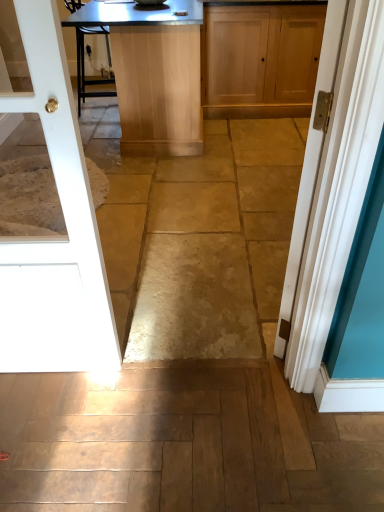
Question: From a real-world perspective, is white painted wood door at right, marked as the first door in a right-to-left arrangement, above or below light brown wooden table at center?

Choices:
 (A) below
 (B) above

Answer: (B)

Question: Is white painted wood door at right, marked as the first door in a right-to-left arrangement, inside the boundaries of light brown wooden table at center, or outside?

Choices:
 (A) inside
 (B) outside

Answer: (B)

Question: Which is farther from the light brown wooden table at center?

Choices:
 (A) matte wood cabinet at upper center
 (B) white painted wood door at right, marked as the first door in a right-to-left arrangement
 (C) white glossy door at left, arranged as the first door when viewed from the left

Answer: (C)

Question: Which of these objects is positioned farthest from the white glossy door at left, acting as the second door starting from the right?

Choices:
 (A) light brown wooden table at center
 (B) white painted wood door at right, positioned as the 2th door in left-to-right order
 (C) matte wood cabinet at upper center

Answer: (C)